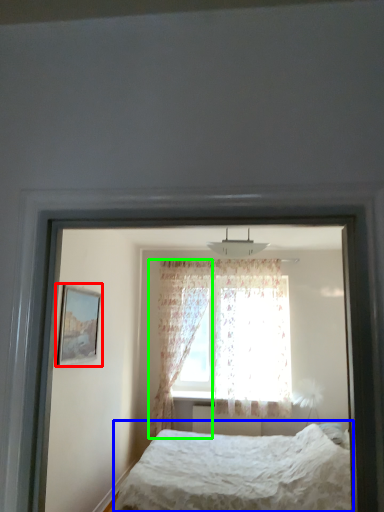
Question: Based on their relative distances, which object is farther from picture frame (highlighted by a red box)? Choose from bed (highlighted by a blue box) and curtain (highlighted by a green box).

Choices:
 (A) bed
 (B) curtain

Answer: (B)